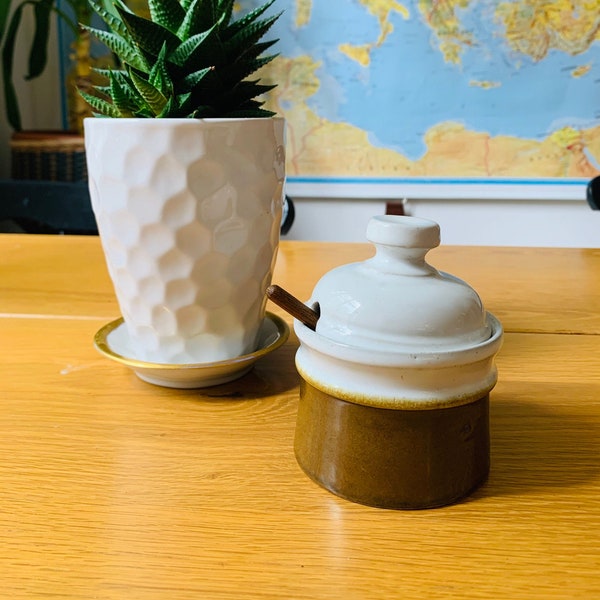
At what (x,y) coordinates should I click in order to perform the action: click on vase. Please return your answer as a coordinate pair (x, y). Looking at the image, I should click on (220, 325).